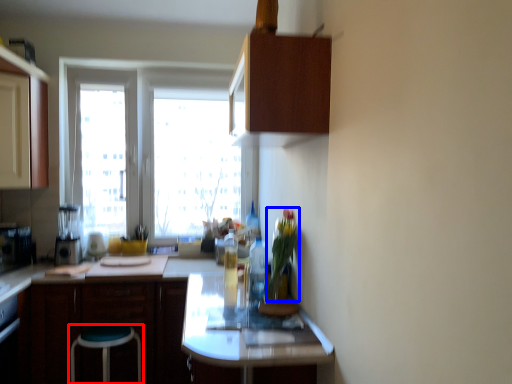
Question: Among these objects, which one is farthest to the camera, stool (highlighted by a red box) or plant (highlighted by a blue box)?

Choices:
 (A) stool
 (B) plant

Answer: (A)